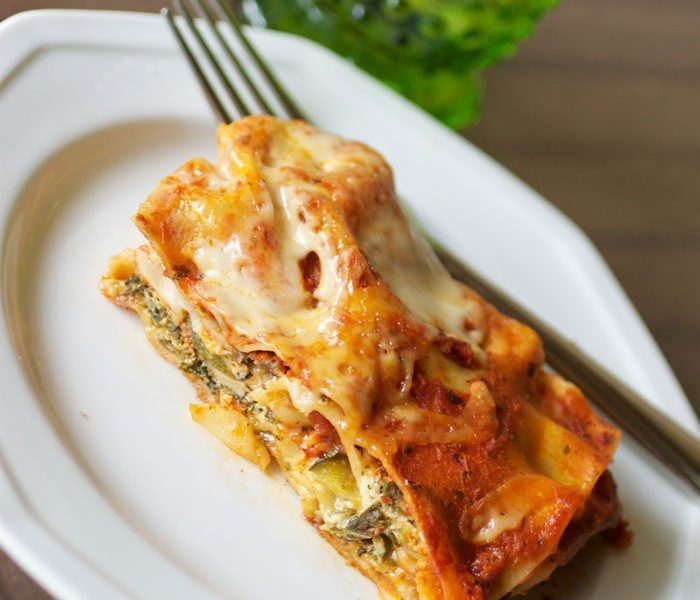
The height and width of the screenshot is (600, 700). What are the coordinates of `white plate` in the screenshot? It's located at (164, 460), (88, 313), (66, 123).